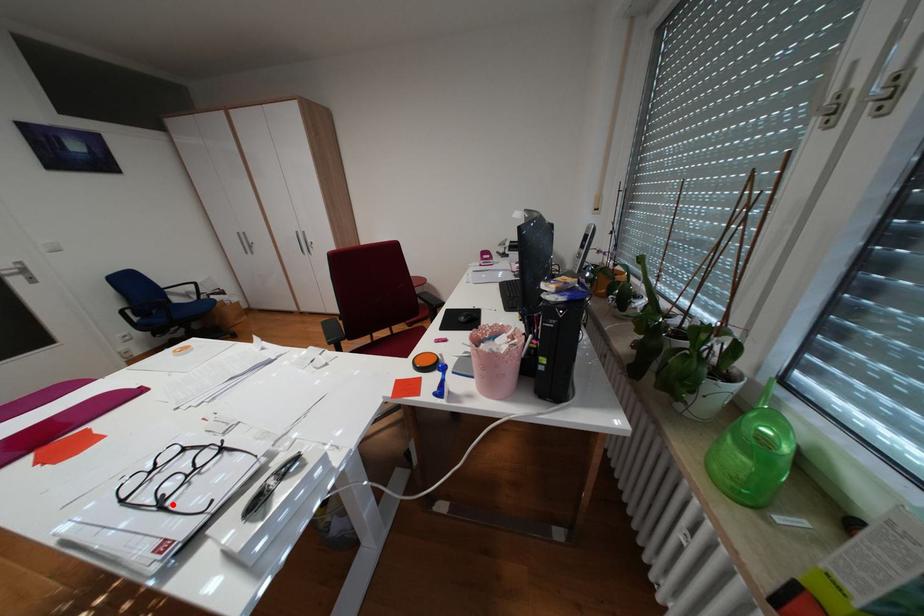
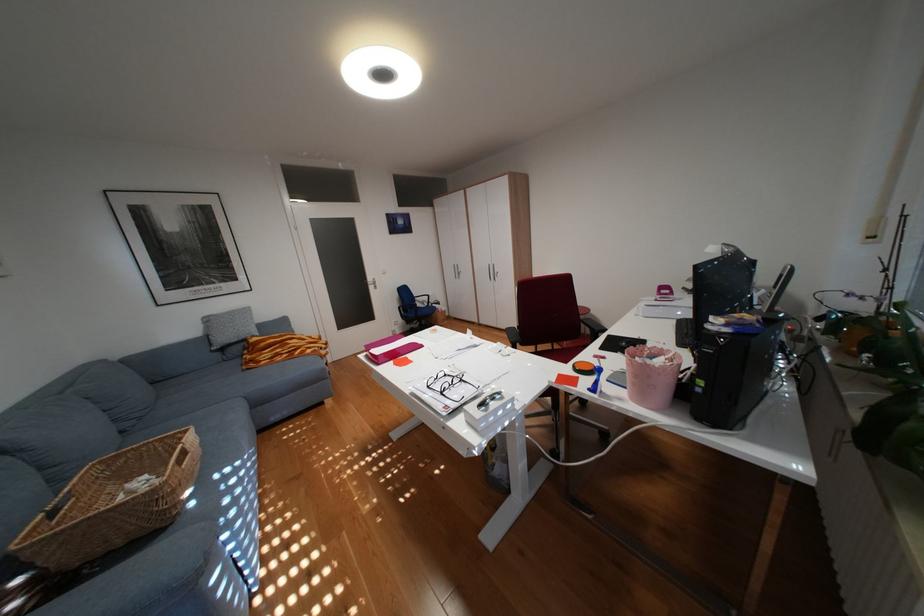
In the second image, find the point that corresponds to the highlighted location in the first image.

(454, 392)